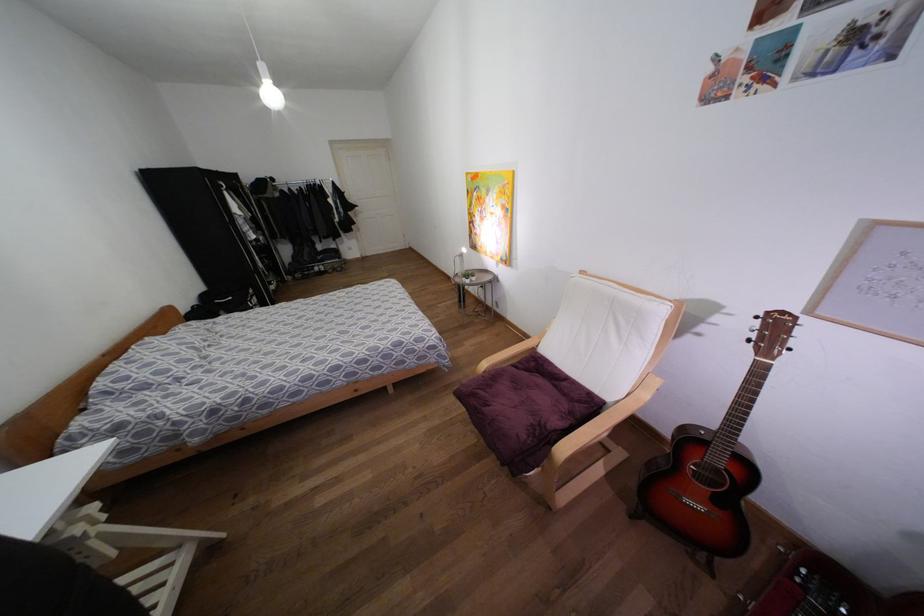
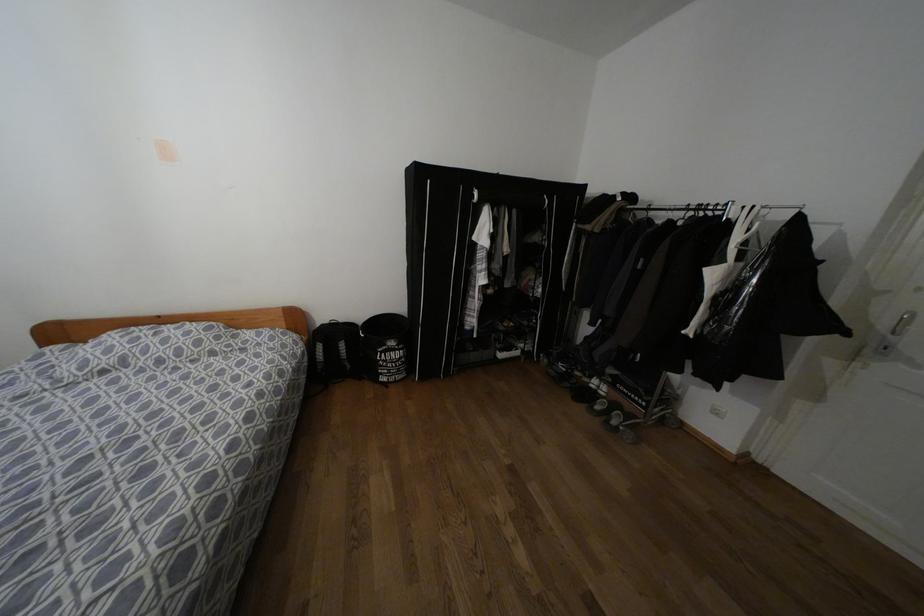
Find the pixel in the second image that matches the point at 250,291 in the first image.

(391, 342)